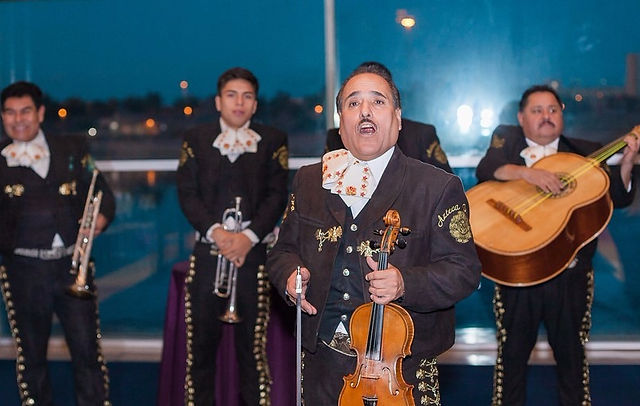
Locate an element on the screen. window is located at coordinates [157, 95], [436, 67].